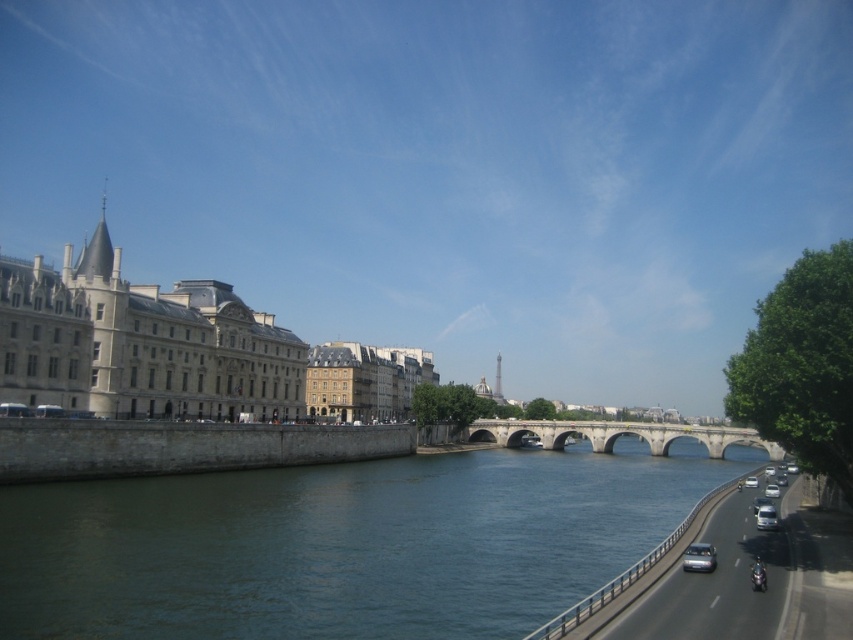
You are a pedestrian standing on the left bank of the river facing the right bank. You see the satin silver car at right and the silver metallic van at right. Which vehicle is closer to the water?

The satin silver car at right is closer to the water because it is positioned below the silver metallic van at right, meaning it is lower in the scene and thus nearer to the riverbank.